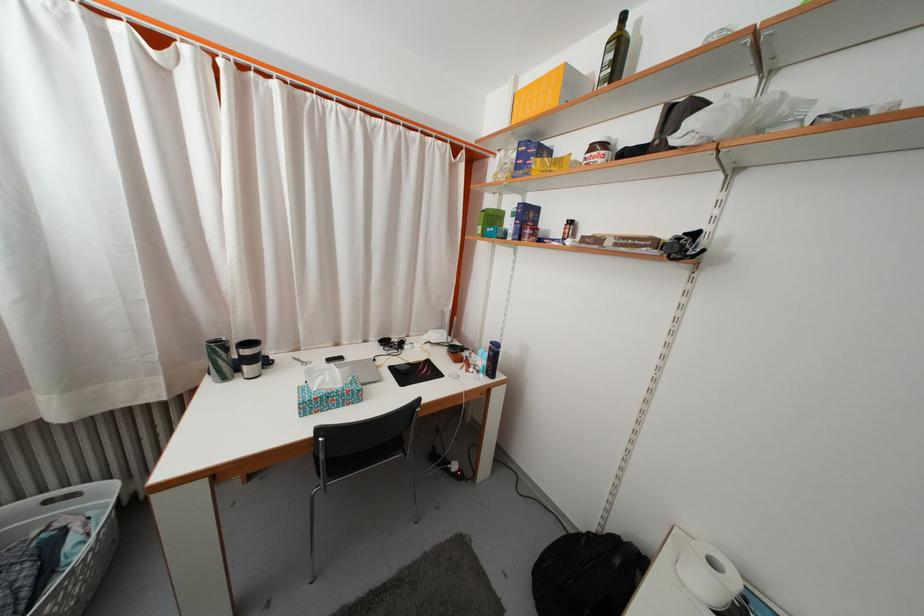
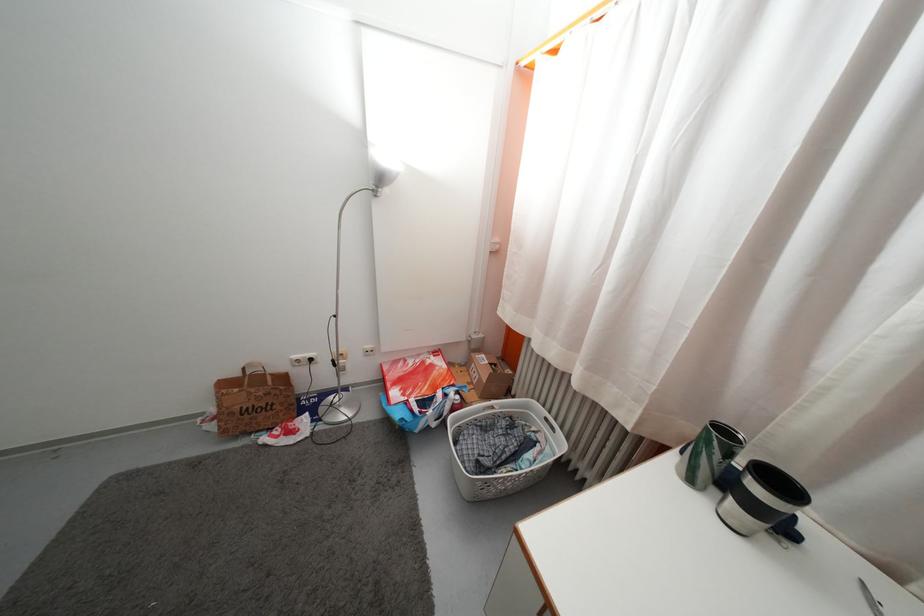
The images are taken continuously from a first-person perspective. In which direction is your viewpoint rotating?

The rotation direction of the camera is left-down.